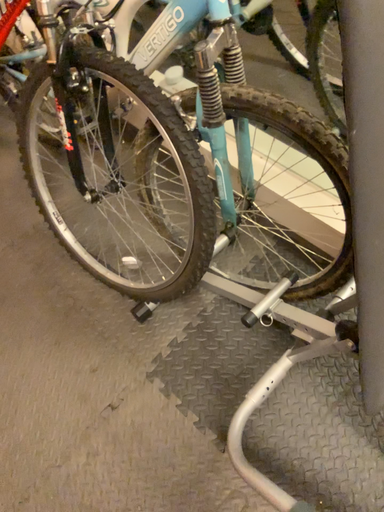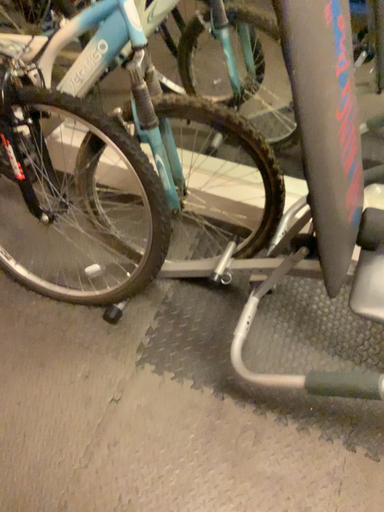
Question: Which way did the camera rotate in the video?

Choices:
 (A) rotated left
 (B) rotated right

Answer: (B)